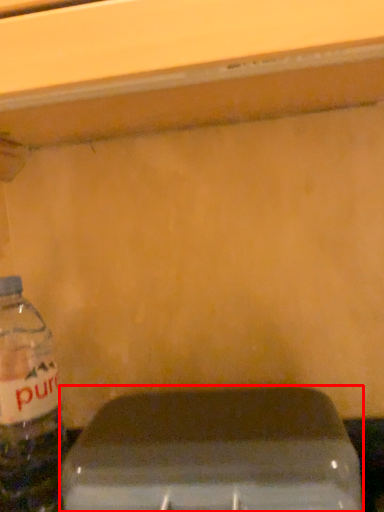
Question: Where is appliance (annotated by the red box) located in relation to bottle in the image?

Choices:
 (A) left
 (B) right

Answer: (B)